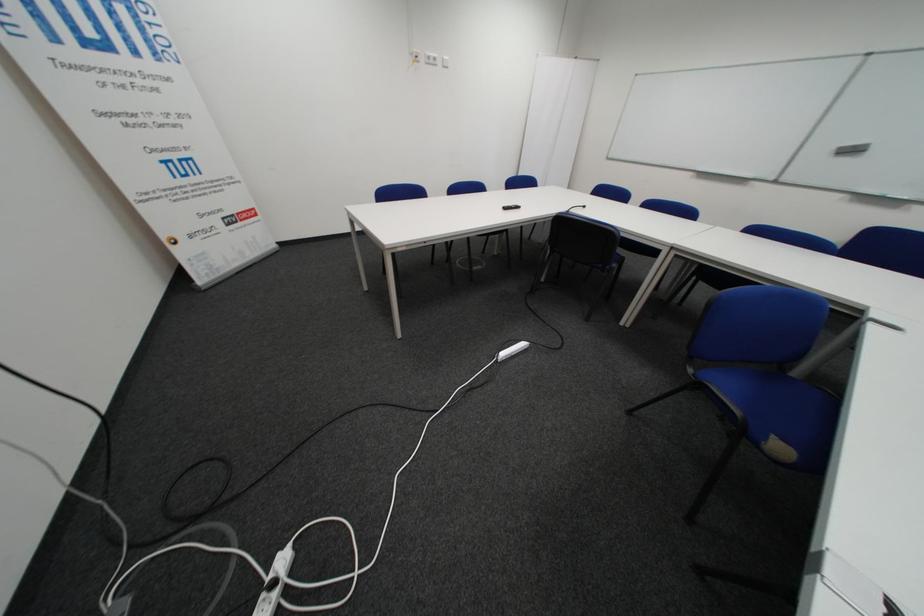
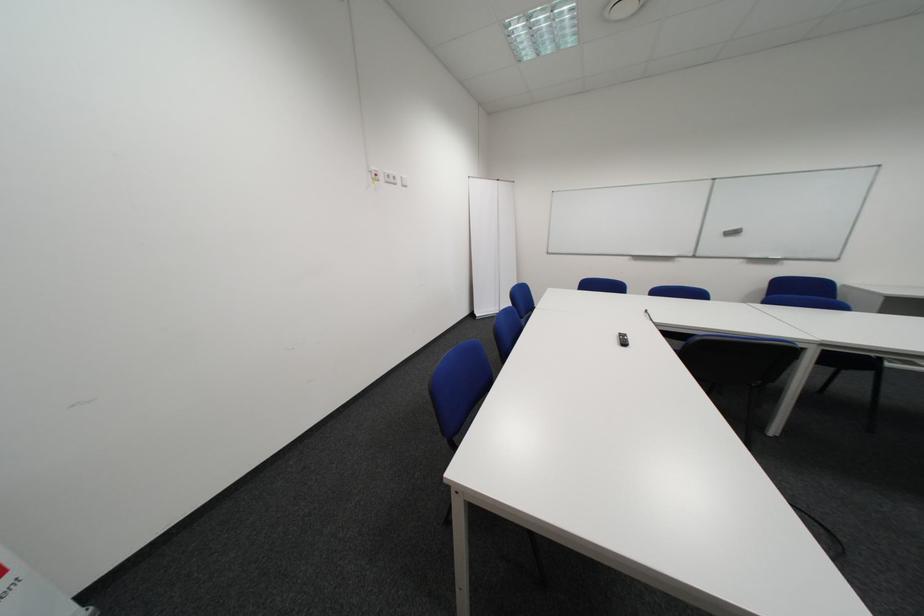
In the second image, find the point that corresponds to pixel 440 62 in the first image.

(398, 180)